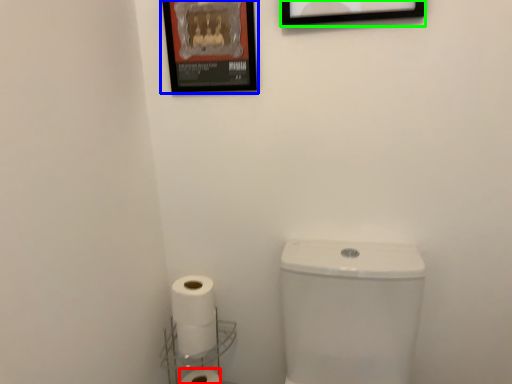
Question: Based on their relative distances, which object is farther from toilet paper (highlighted by a red box)? Choose from picture frame (highlighted by a blue box) and picture frame (highlighted by a green box).

Choices:
 (A) picture frame
 (B) picture frame

Answer: (B)